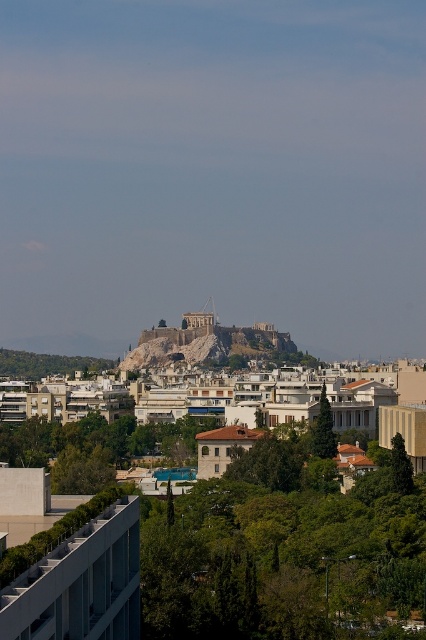
Question: Is green leafy tree at lower center below green leafy tree at lower left?

Choices:
 (A) no
 (B) yes

Answer: (B)

Question: Is green leafy tree at lower center above green leafy tree at lower left?

Choices:
 (A) yes
 (B) no

Answer: (B)

Question: Which object appears closest to the camera in this image?

Choices:
 (A) green leafy tree at lower center
 (B) green leafy tree at lower left
 (C) green leafy tree at center

Answer: (A)

Question: Is stone/rocky hill at center bigger than green leafy tree at center?

Choices:
 (A) no
 (B) yes

Answer: (B)

Question: Which point is closer to the camera?

Choices:
 (A) (175, 436)
 (B) (25, 352)

Answer: (A)

Question: Which of these objects is positioned farthest from the green leafy tree at lower center?

Choices:
 (A) stone/rocky hill at center
 (B) green leafy tree at lower left

Answer: (A)